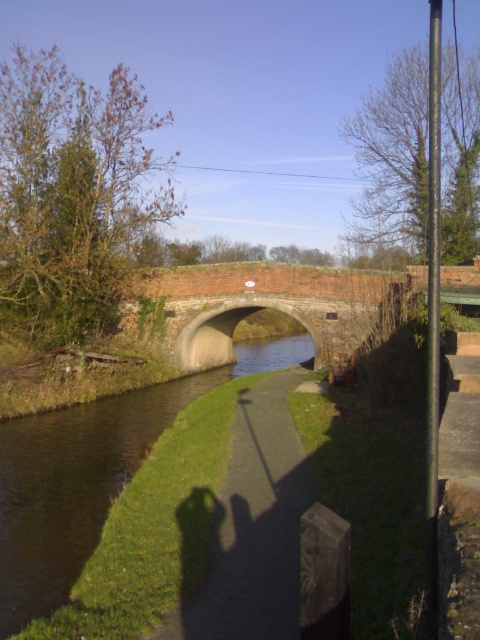
Does dark green water at center have a lesser width compared to concrete bridge at center?

Yes.

Can you confirm if dark green water at center is positioned to the left of concrete bridge at center?

Correct, you'll find dark green water at center to the left of concrete bridge at center.

Is point (0, 604) positioned after point (132, 305)?

No.

You are a GUI agent. You are given a task and a screenshot of the screen. Output one action in this format:
    pyautogui.click(x=<x>, y=<y>)
    Task: Click on the dark green water at center
    
    Given the screenshot: What is the action you would take?
    pyautogui.click(x=86, y=476)